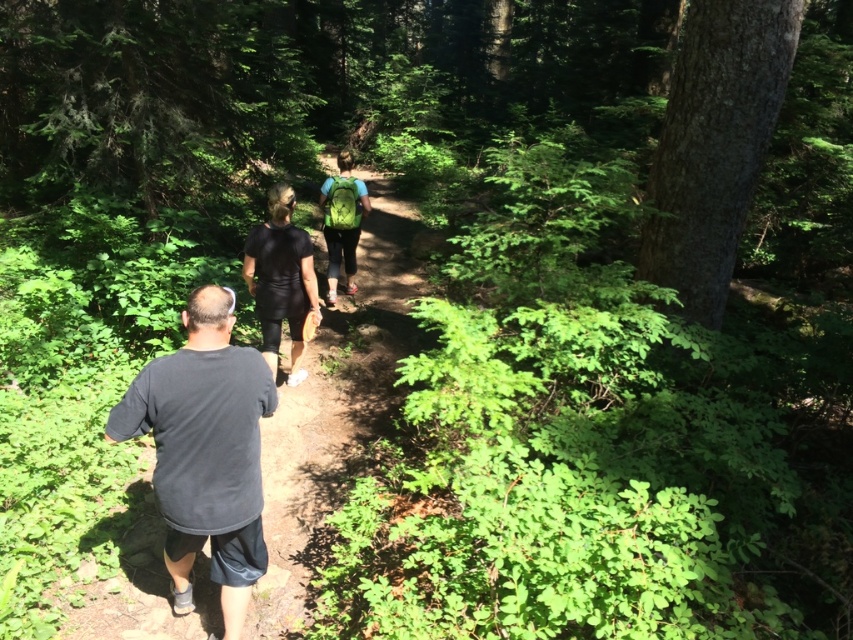
Based on the photo, you are a hiker standing at the starting point of the forest trail. You notice two points marked on the trail ahead of you at coordinates point (x=229, y=506) and point (x=247, y=541). Which point is closer to your current position?

Point (x=229, y=506) is closer to the camera than point (x=247, y=541), so the point closer to your current position is point (x=229, y=506).